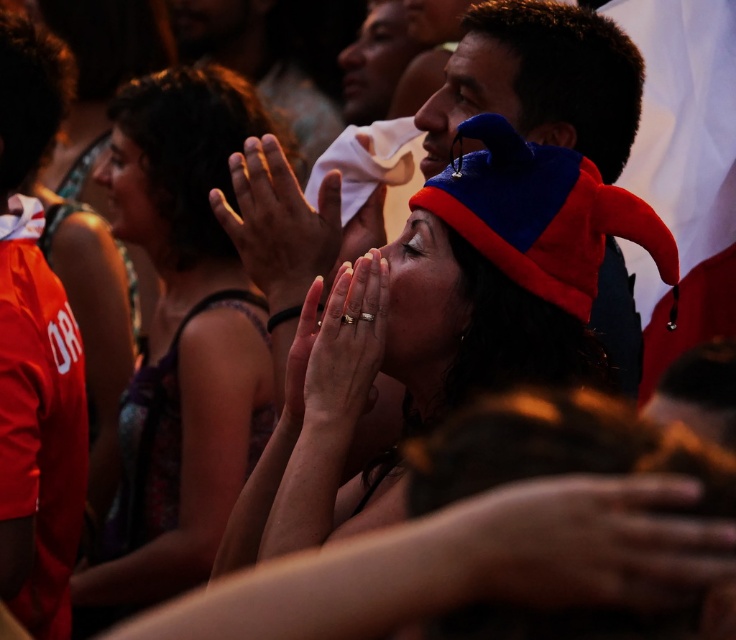
You are at a lively event and see two points in the scene. The first point is at coordinates point (297, 186) and the second is at point (314, 342). If you are facing the scene, which point is closer to you?

Point (314, 342) is closer to you because point (297, 186) is behind it.

You are at a crowded event and notice two items at the center of the scene. Which one is located to the right of the other? The items are the matte blue hat at center and the gold metallic ring at center.

The matte blue hat at center is positioned on the right side of the gold metallic ring at center.